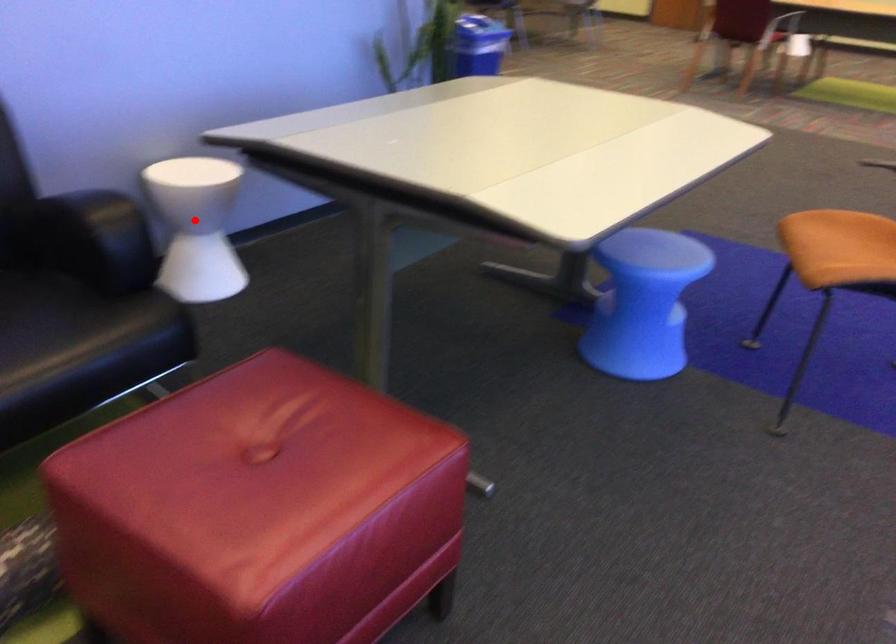
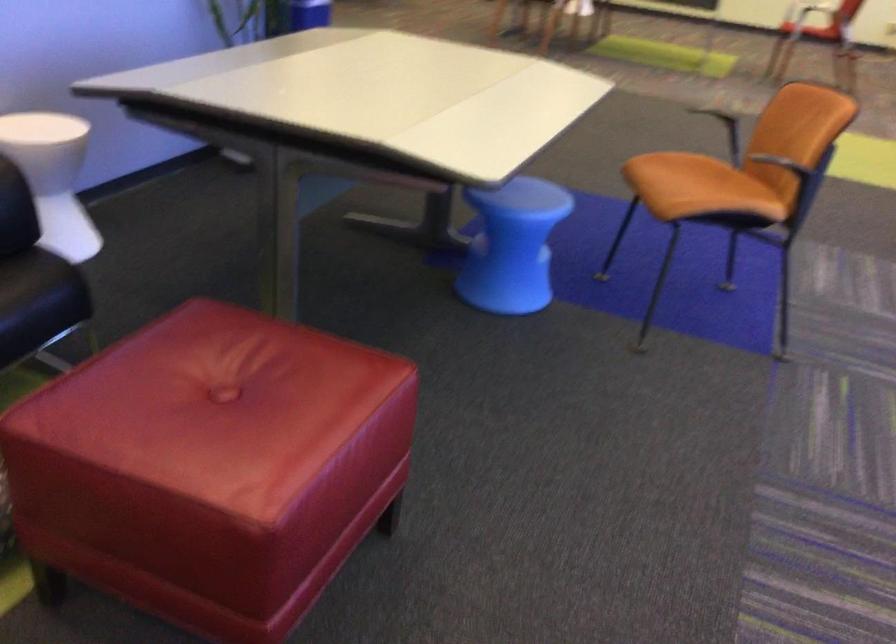
The point at the highlighted location is marked in the first image. Where is the corresponding point in the second image?

(53, 176)